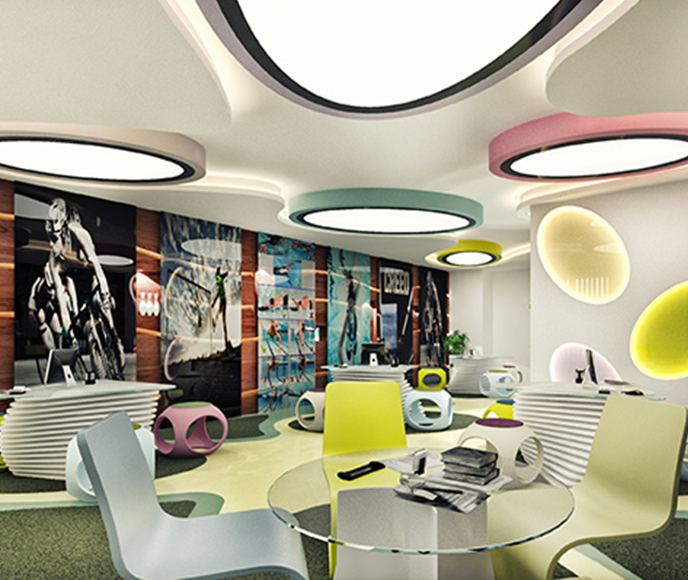
Where is `ceiling lights`? The height and width of the screenshot is (580, 688). ceiling lights is located at coordinates (92, 164), (389, 218), (477, 257), (594, 161), (439, 31).